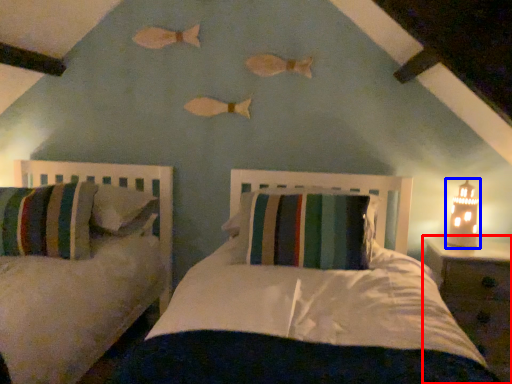
Question: Which object appears closest to the camera in this image, nightstand (highlighted by a red box) or table lamp (highlighted by a blue box)?

Choices:
 (A) nightstand
 (B) table lamp

Answer: (A)